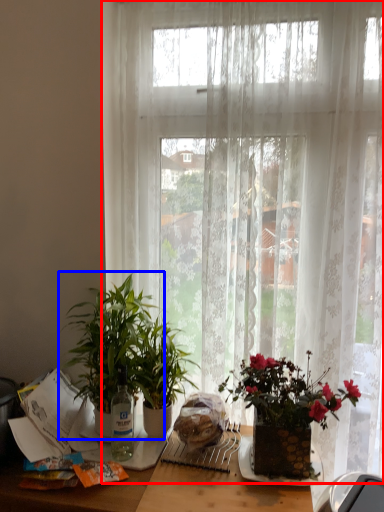
Question: Which point is further to the camera, curtain (highlighted by a red box) or houseplant (highlighted by a blue box)?

Choices:
 (A) curtain
 (B) houseplant

Answer: (A)